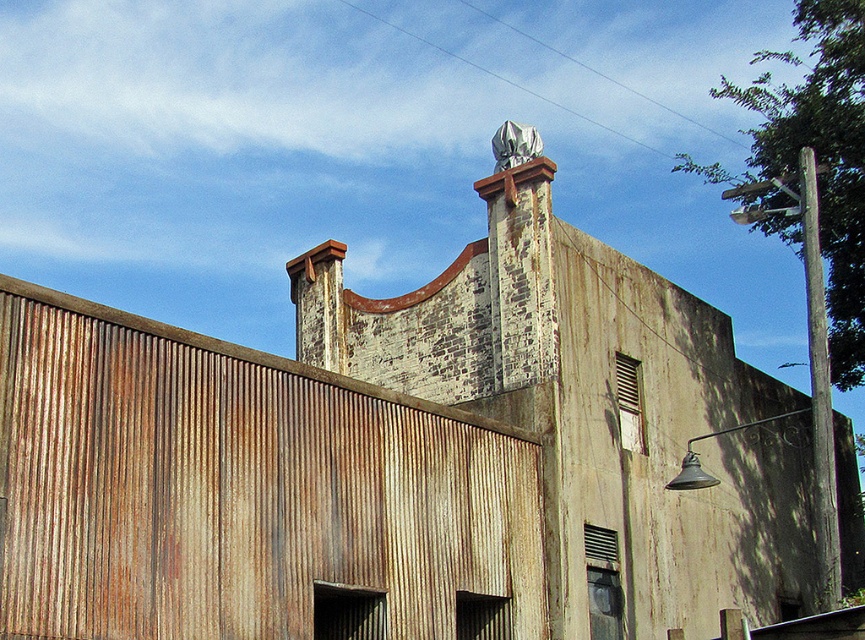
You are standing in front of the weathered building and notice two points marked on its facade. The first point is at coordinate point (279,612) and the second is at point (609,342). Which of these points is located closer to your current position?

Point (279,612) is closer to the viewer than point (609,342).

You are an architect analyzing the building structure. Based on the image, where is the rusty corrugated metal at center located in terms of coordinates?

The rusty corrugated metal at center is located at coordinates point (244, 492).